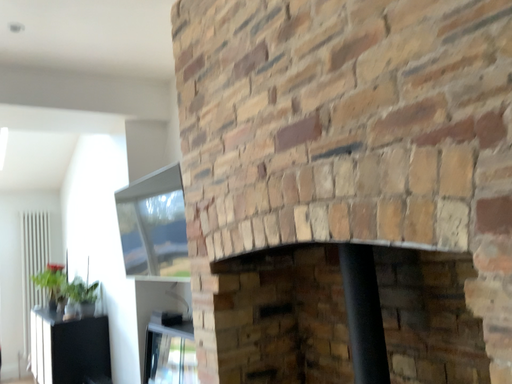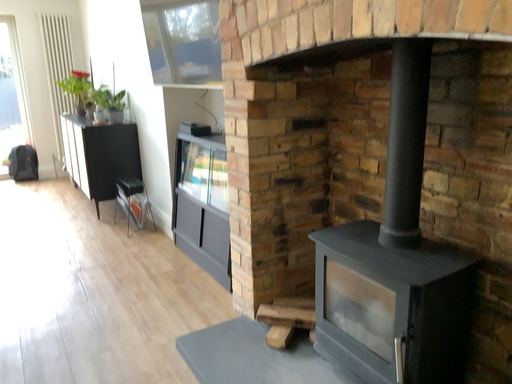
Question: How did the camera likely rotate when shooting the video?

Choices:
 (A) rotated upward
 (B) rotated downward

Answer: (B)